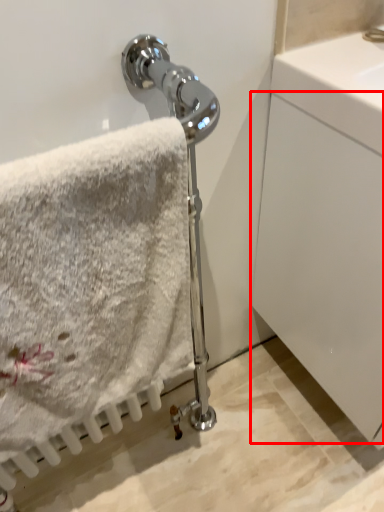
Question: From the image, what is the correct spatial relationship of glass door (annotated by the red box) in relation to towel?

Choices:
 (A) right
 (B) left

Answer: (A)